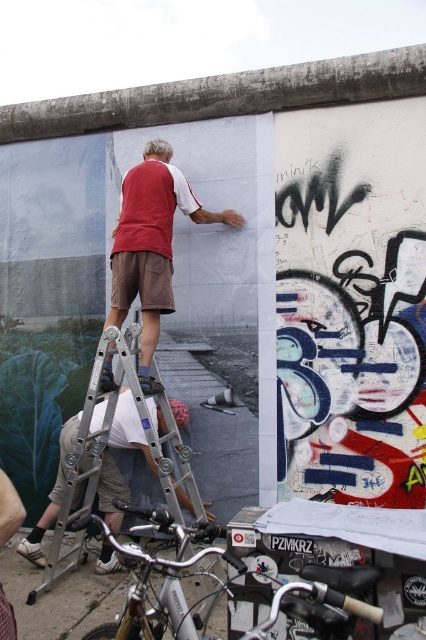
Question: Is silver metallic ladder at center bigger than silver metallic bicycle at lower center?

Choices:
 (A) yes
 (B) no

Answer: (A)

Question: Which point is closer to the camera?

Choices:
 (A) (144, 435)
 (B) (138, 632)

Answer: (B)

Question: Which object is positioned closest to the silver metallic ladder at center?

Choices:
 (A) matte red t-shirt at center
 (B) silver metallic bicycle at lower center

Answer: (A)

Question: Considering the real-world distances, which object is farthest from the silver metallic bicycle at lower center?

Choices:
 (A) matte red t-shirt at center
 (B) silver metallic ladder at center

Answer: (A)

Question: Is silver metallic ladder at center positioned behind silver metallic bicycle at lower center?

Choices:
 (A) no
 (B) yes

Answer: (B)

Question: Can you confirm if silver metallic ladder at center is smaller than silver metallic bicycle at lower center?

Choices:
 (A) no
 (B) yes

Answer: (A)